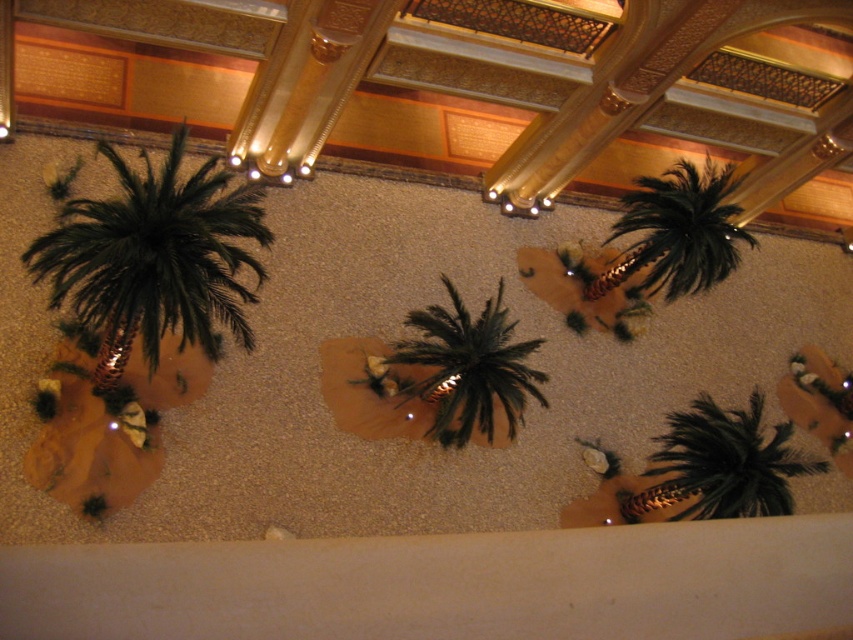
You are standing in the lobby and want to place a 7 meter long banner along the wall behind the green artificial palm tree at left. Will the banner fit without overlapping the palm tree?

The green artificial palm tree at left is 7.17 meters from the viewer. Since the banner is 7 meters long, it will fit without overlapping the palm tree as it is slightly farther than the banner length.

You are designing a layout for a new exhibit and need to place both the green matte palm tree at center and the black feathered palm tree at upper right in a confined space. Which palm tree should you prioritize placing first to ensure both fit comfortably?

The green matte palm tree at center occupies less space than the black feathered palm tree at upper right, so you should prioritize placing the black feathered palm tree at upper right first to ensure both fit comfortably.

You are a visitor standing in the lobby and want to take a photo of both the green matte palm tree at center and the black feathered palm tree at upper right. Which palm tree should you position closer to the camera to ensure both are fully visible in the frame?

You should position the black feathered palm tree at upper right closer to the camera since it is shorter than the green matte palm tree at center, allowing both to be in frame without one blocking the other.